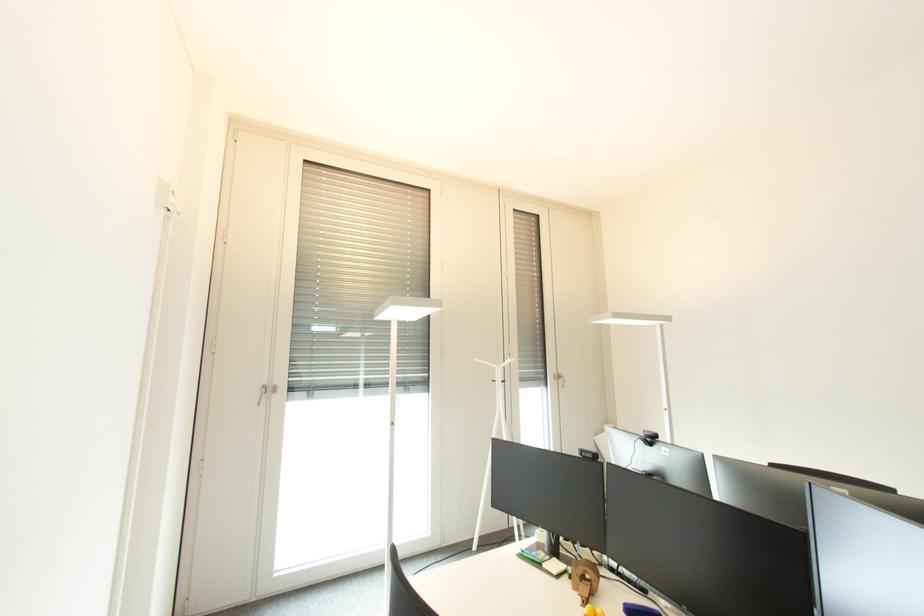
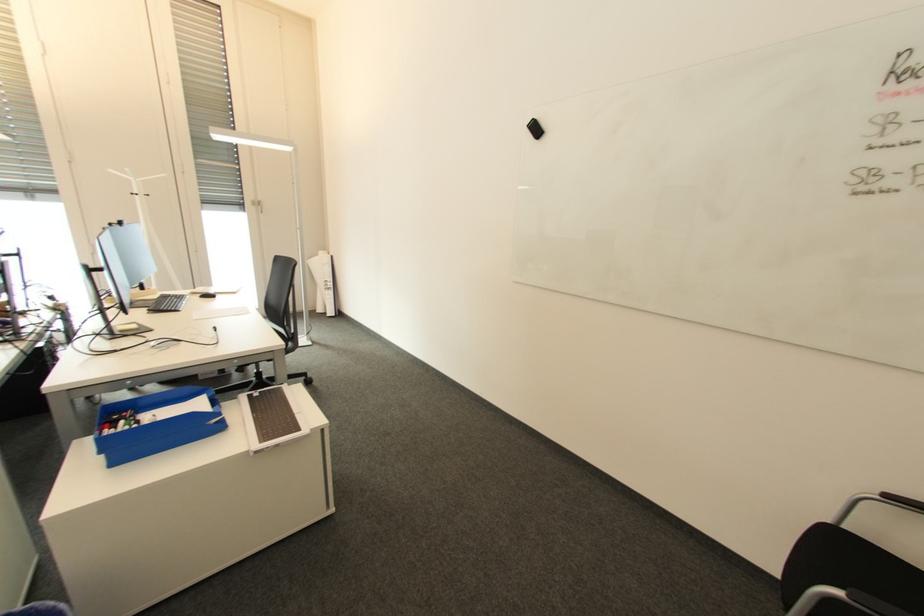
Question: Which direction would the cameraman need to move to produce the second image? Reply with the corresponding letter.

Choices:
 (A) Left
 (B) Right
 (C) Forward
 (D) Backward

Answer: (B)